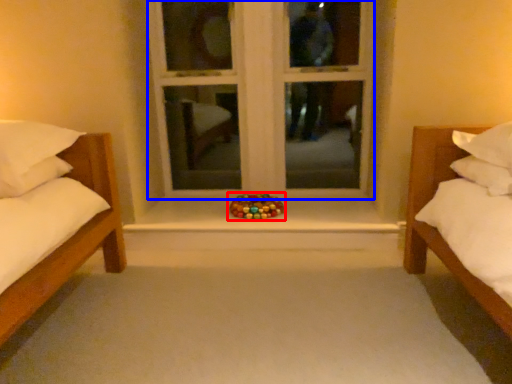
Question: Which object appears farthest to the camera in this image, toy (highlighted by a red box) or window frame (highlighted by a blue box)?

Choices:
 (A) toy
 (B) window frame

Answer: (B)